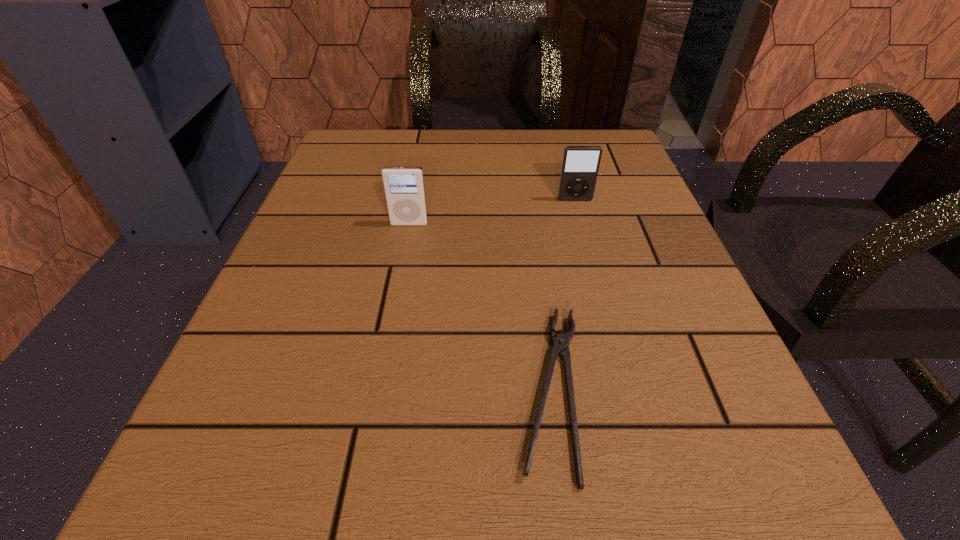
Locate an element on the screen. The image size is (960, 540). the left iPod is located at coordinates (404, 186).

The width and height of the screenshot is (960, 540). What are the coordinates of `the nearer iPod` in the screenshot? It's located at (404, 186).

Identify the location of the rightmost object. Image resolution: width=960 pixels, height=540 pixels. (580, 164).

You are a GUI agent. You are given a task and a screenshot of the screen. Output one action in this format:
    pyautogui.click(x=<x>, y=<y>)
    Task: Click on the farthest object
    
    Given the screenshot: What is the action you would take?
    pyautogui.click(x=580, y=164)

At what (x,y) coordinates should I click in order to perform the action: click on the second object from right to left. Please return your answer as a coordinate pair (x, y). Looking at the image, I should click on (560, 343).

The width and height of the screenshot is (960, 540). What are the coordinates of `the shortest object` in the screenshot? It's located at (560, 343).

I want to click on free space located on the front-facing side of the second farthest object, so click(x=367, y=445).

Where is `free space located on the front-facing side of the farther iPod`? free space located on the front-facing side of the farther iPod is located at coordinates (588, 251).

This screenshot has height=540, width=960. Identify the location of vacant area located on the back of the shortest object. (525, 192).

I want to click on object that is positioned at the near edge, so click(x=560, y=343).